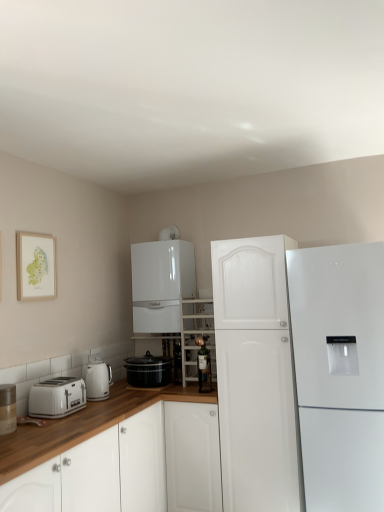
What is the approximate height of white glossy refrigerator at upper center, acting as the 2th refrigerator starting from the right?

white glossy refrigerator at upper center, acting as the 2th refrigerator starting from the right, is 34.13 inches tall.

The image size is (384, 512). Describe the element at coordinates (83, 426) in the screenshot. I see `white glossy cabinet at lower left` at that location.

What do you see at coordinates (7, 409) in the screenshot?
I see `matte silver canister at left` at bounding box center [7, 409].

The height and width of the screenshot is (512, 384). In order to click on matte silver canister at left in this screenshot , I will do [x=7, y=409].

Describe the element at coordinates (36, 266) in the screenshot. I see `wooden framed map at upper left` at that location.

The height and width of the screenshot is (512, 384). Identify the location of white glossy refrigerator at upper center, acting as the 2th refrigerator starting from the right. (161, 284).

Are matte glass bottle at center and clear glass shelves at center far apart?

matte glass bottle at center is actually quite close to clear glass shelves at center.

Choose the correct answer: Is matte glass bottle at center inside clear glass shelves at center or outside it?

matte glass bottle at center is outside clear glass shelves at center.

From a real-world perspective, which object rests below the other?

matte glass bottle at center, from a real-world perspective.

Between point (197, 360) and point (214, 366), which one is positioned behind?

The point (197, 360) is behind.

Where is `the 2nd refrigerator behind the white glossy cabinet at lower left, starting your count from the anchor`? Image resolution: width=384 pixels, height=512 pixels. the 2nd refrigerator behind the white glossy cabinet at lower left, starting your count from the anchor is located at coordinates (161, 284).

Is white glossy refrigerator at upper center, the 1th refrigerator positioned from the left, further to camera compared to white glossy cabinet at lower left?

Yes, it is.

Does white glossy refrigerator at upper center, acting as the 2th refrigerator starting from the right, have a greater height compared to white glossy cabinet at lower left?

Incorrect, the height of white glossy refrigerator at upper center, acting as the 2th refrigerator starting from the right, is not larger of that of white glossy cabinet at lower left.

From the image's perspective, is white glossy refrigerator at upper center, the 1th refrigerator positioned from the left, below white glossy cabinet at lower left?

No.

Is white glossy refrigerator at upper center, the 1th refrigerator positioned from the left, at the left side of wooden framed map at upper left?

No, white glossy refrigerator at upper center, the 1th refrigerator positioned from the left, is not to the left of wooden framed map at upper left.

Is wooden framed map at upper left at the back of white glossy refrigerator at upper center, the 1th refrigerator positioned from the left?

white glossy refrigerator at upper center, the 1th refrigerator positioned from the left, is not turned away from wooden framed map at upper left.

Is white glossy refrigerator at upper center, the 1th refrigerator positioned from the left, wider than wooden framed map at upper left?

Yes, white glossy refrigerator at upper center, the 1th refrigerator positioned from the left, is wider than wooden framed map at upper left.

Between white glossy refrigerator at upper center, acting as the 2th refrigerator starting from the right, and matte glass bottle at center, which one has larger width?

With larger width is white glossy refrigerator at upper center, acting as the 2th refrigerator starting from the right.

From a real-world perspective, is white glossy refrigerator at upper center, the 1th refrigerator positioned from the left, over matte glass bottle at center?

Yes, from a real-world perspective, white glossy refrigerator at upper center, the 1th refrigerator positioned from the left, is above matte glass bottle at center.

Are white glossy refrigerator at upper center, acting as the 2th refrigerator starting from the right, and matte glass bottle at center making contact?

No, white glossy refrigerator at upper center, acting as the 2th refrigerator starting from the right, is not next to matte glass bottle at center.

Does white glossy refrigerator at upper center, the 1th refrigerator positioned from the left, lie behind matte glass bottle at center?

Yes.

Is white matte cabinet at center, acting as the 1th refrigerator starting from the right, at the back of clear glass shelves at center?

No, clear glass shelves at center is not facing the opposite direction of white matte cabinet at center, acting as the 1th refrigerator starting from the right.

You are a GUI agent. You are given a task and a screenshot of the screen. Output one action in this format:
    pyautogui.click(x=<x>, y=<y>)
    Task: Click on the shelf that is on the left side of white matte cabinet at center, the second refrigerator when ordered from left to right
    This screenshot has height=512, width=384.
    Given the screenshot: What is the action you would take?
    pyautogui.click(x=196, y=335)

Is clear glass shelves at center not near white matte cabinet at center, the second refrigerator when ordered from left to right?

Actually, clear glass shelves at center and white matte cabinet at center, the second refrigerator when ordered from left to right, are a little close together.

Considering the relative sizes of clear glass shelves at center and white matte cabinet at center, acting as the 1th refrigerator starting from the right, in the image provided, is clear glass shelves at center shorter than white matte cabinet at center, acting as the 1th refrigerator starting from the right,?

Indeed, clear glass shelves at center has a lesser height compared to white matte cabinet at center, acting as the 1th refrigerator starting from the right.

Does point (277, 319) appear closer or farther from the camera than point (81, 395)?

Point (277, 319).

Based on their sizes in the image, would you say white matte cabinet at center, the second refrigerator when ordered from left to right, is bigger or smaller than white plastic toaster at lower left?

In the image, white matte cabinet at center, the second refrigerator when ordered from left to right, appears to be larger than white plastic toaster at lower left.

From the image's perspective, is white matte cabinet at center, the second refrigerator when ordered from left to right, located beneath white plastic toaster at lower left?

No, from the image's perspective, white matte cabinet at center, the second refrigerator when ordered from left to right, is not beneath white plastic toaster at lower left.

Between white matte cabinet at center, acting as the 1th refrigerator starting from the right, and white plastic toaster at lower left, which one appears on the left side from the viewer's perspective?

Positioned to the left is white plastic toaster at lower left.

Is white plastic toaster at lower left spatially inside white glossy electric kettle at left, acting as the first kitchen appliance starting from the left, or outside of it?

white plastic toaster at lower left is located beyond the bounds of white glossy electric kettle at left, acting as the first kitchen appliance starting from the left.

Is white plastic toaster at lower left touching white glossy electric kettle at left, acting as the first kitchen appliance starting from the left?

There is a gap between white plastic toaster at lower left and white glossy electric kettle at left, acting as the first kitchen appliance starting from the left.

From a real-world perspective, is white plastic toaster at lower left on white glossy electric kettle at left, the 2th kitchen appliance positioned from the right?

No, from a real-world perspective, white plastic toaster at lower left is not over white glossy electric kettle at left, the 2th kitchen appliance positioned from the right

Where is `bottle that appears in front of the clear glass shelves at center`? This screenshot has width=384, height=512. bottle that appears in front of the clear glass shelves at center is located at coordinates (204, 366).

At what (x,y) coordinates should I click in order to perform the action: click on cabinetry on the left of white glossy refrigerator at upper center, acting as the 2th refrigerator starting from the right. Please return your answer as a coordinate pair (x, y). This screenshot has height=512, width=384. Looking at the image, I should click on (83, 426).

Which object lies nearer to the anchor point white glossy refrigerator at upper center, acting as the 2th refrigerator starting from the right, matte silver canister at left or white glossy cabinet at lower left?

white glossy cabinet at lower left is positioned closer to the anchor white glossy refrigerator at upper center, acting as the 2th refrigerator starting from the right.

When comparing their distances from white glossy refrigerator at upper center, acting as the 2th refrigerator starting from the right, does white plastic toaster at lower left or matte glass bottle at center seem closer?

matte glass bottle at center.

Estimate the real-world distances between objects in this image. Which object is closer to black glossy slow cooker at lower center, marked as the first kitchen appliance in a right-to-left arrangement, white plastic toaster at lower left or white glossy cabinet at lower left?

white glossy cabinet at lower left.

Estimate the real-world distances between objects in this image. Which object is closer to wooden framed map at upper left, white glossy electric kettle at left, acting as the first kitchen appliance starting from the left, or white plastic toaster at lower left?

The object closer to wooden framed map at upper left is white plastic toaster at lower left.

When comparing their distances from white plastic toaster at lower left, does matte glass bottle at center or white matte cabinet at center, the second refrigerator when ordered from left to right, seem further?

white matte cabinet at center, the second refrigerator when ordered from left to right.

Looking at this image, which object lies further to the anchor point white glossy refrigerator at upper center, acting as the 2th refrigerator starting from the right, white plastic toaster at lower left or clear glass shelves at center?

Among the two, white plastic toaster at lower left is located further to white glossy refrigerator at upper center, acting as the 2th refrigerator starting from the right.

Considering their positions, is black glossy slow cooker at lower center, which is the 2th kitchen appliance from left to right, positioned further to matte silver canister at left than white glossy cabinet at lower left?

Among the two, black glossy slow cooker at lower center, which is the 2th kitchen appliance from left to right, is located further to matte silver canister at left.

Looking at the image, which one is located further to matte glass bottle at center, white plastic toaster at lower left or white glossy refrigerator at upper center, acting as the 2th refrigerator starting from the right?

white plastic toaster at lower left.

This screenshot has height=512, width=384. What are the coordinates of `refrigerator located between wooden framed map at upper left and clear glass shelves at center in the left-right direction` in the screenshot? It's located at click(161, 284).

Locate an element on the screen. bottle between white plastic toaster at lower left and white matte cabinet at center, the second refrigerator when ordered from left to right, in the horizontal direction is located at coordinates (204, 366).

You are a GUI agent. You are given a task and a screenshot of the screen. Output one action in this format:
    pyautogui.click(x=<x>, y=<y>)
    Task: Click on the refrigerator between white glossy cabinet at lower left and white glossy refrigerator at upper center, the 1th refrigerator positioned from the left, from front to back
    The height and width of the screenshot is (512, 384).
    Given the screenshot: What is the action you would take?
    pyautogui.click(x=255, y=375)

Identify the location of refrigerator between white glossy cabinet at lower left and black glossy slow cooker at lower center, which is the 2th kitchen appliance from left to right, in the front-back direction. Image resolution: width=384 pixels, height=512 pixels. (255, 375).